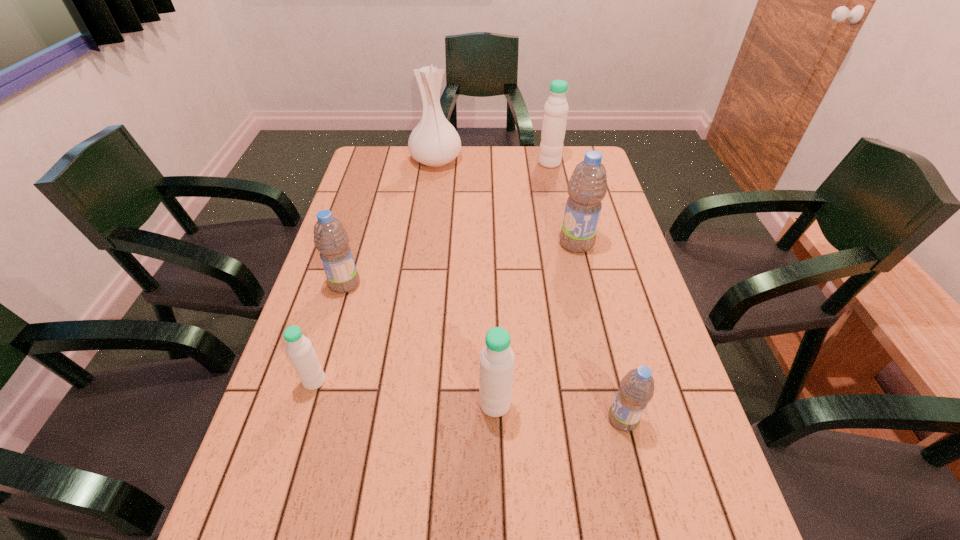
Identify the location of the third object from left to right. [x=434, y=142].

At what (x,y) coordinates should I click in order to perform the action: click on white vase. Please return your answer as a coordinate pair (x, y). Image resolution: width=960 pixels, height=540 pixels. Looking at the image, I should click on (434, 142).

Locate an element on the screen. The height and width of the screenshot is (540, 960). the farthest water bottle is located at coordinates click(x=554, y=122).

You are a GUI agent. You are given a task and a screenshot of the screen. Output one action in this format:
    pyautogui.click(x=<x>, y=<y>)
    Task: Click on the farthest white water bottle
    
    Given the screenshot: What is the action you would take?
    pyautogui.click(x=554, y=122)

The width and height of the screenshot is (960, 540). Find the location of `the second farthest water bottle`. the second farthest water bottle is located at coordinates (587, 187).

What are the coordinates of `the biggest blue water bottle` in the screenshot? It's located at (587, 187).

Locate an element on the screen. The height and width of the screenshot is (540, 960). the leftmost blue water bottle is located at coordinates (330, 237).

Where is `the fourth farthest object`? Image resolution: width=960 pixels, height=540 pixels. the fourth farthest object is located at coordinates (330, 237).

The width and height of the screenshot is (960, 540). I want to click on the second biggest white water bottle, so click(x=496, y=359).

I want to click on the third water bottle from left to right, so click(496, 359).